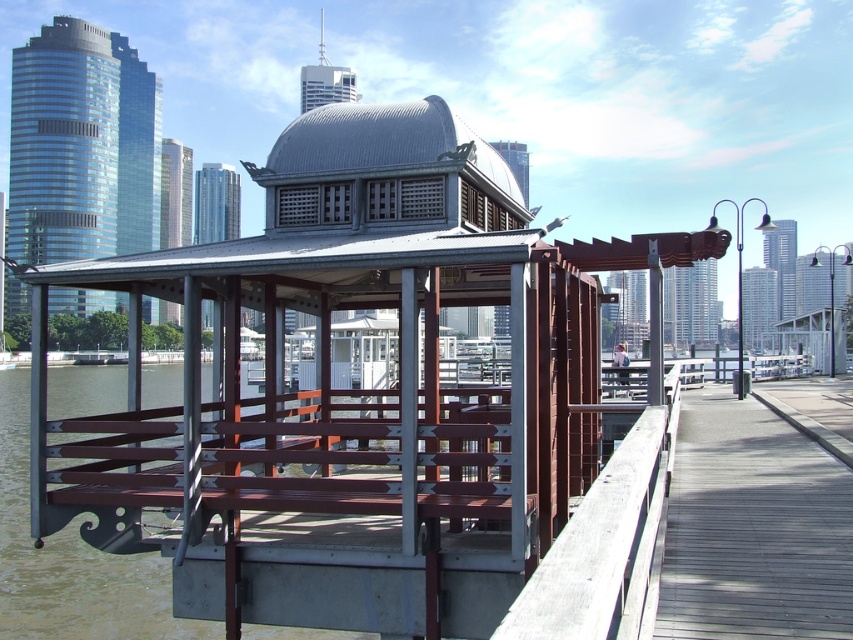
Question: Does metallic/glossy gazebo at center appear on the left side of wooden at right?

Choices:
 (A) no
 (B) yes

Answer: (B)

Question: Which object appears farthest from the camera in this image?

Choices:
 (A) wooden at right
 (B) metallic/glossy gazebo at center

Answer: (A)

Question: Among these objects, which one is nearest to the camera?

Choices:
 (A) metallic/glossy gazebo at center
 (B) wooden at right

Answer: (A)

Question: Can you confirm if metallic/glossy gazebo at center is smaller than wooden at right?

Choices:
 (A) no
 (B) yes

Answer: (A)

Question: In this image, where is metallic/glossy gazebo at center located relative to wooden at right?

Choices:
 (A) above
 (B) below

Answer: (A)

Question: Among these points, which one is farthest from the camera?

Choices:
 (A) (781, 584)
 (B) (548, 506)

Answer: (B)